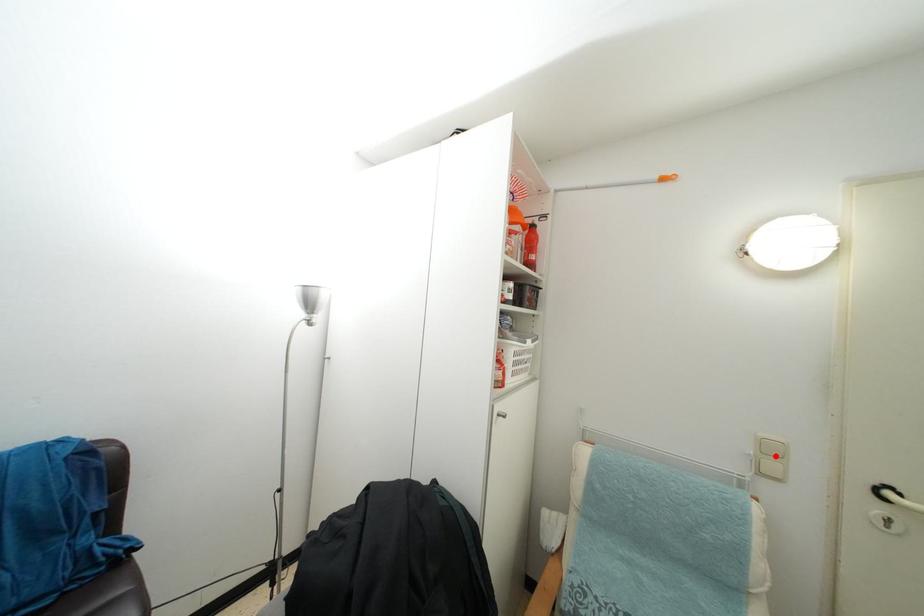
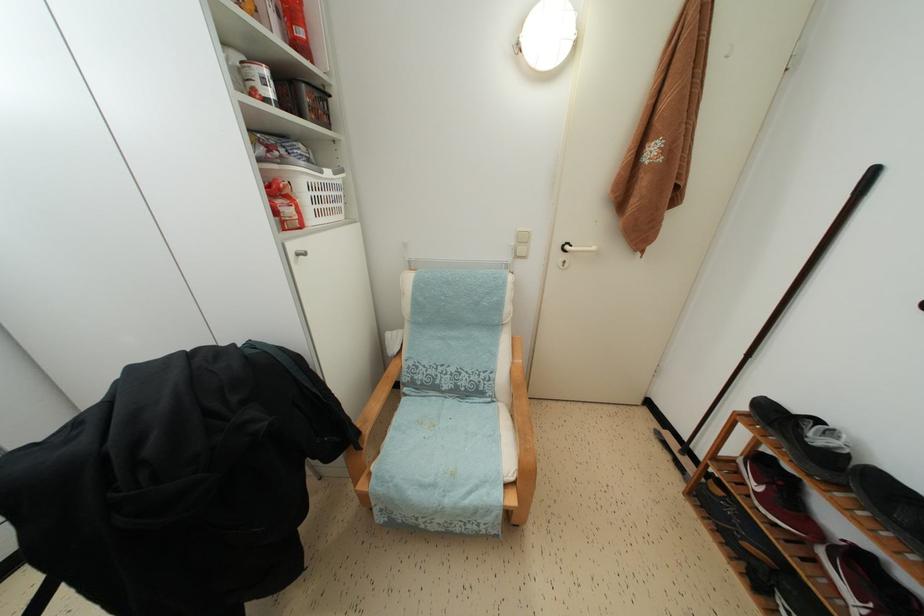
Locate, in the second image, the point that corresponds to the highlighted location in the first image.

(527, 245)